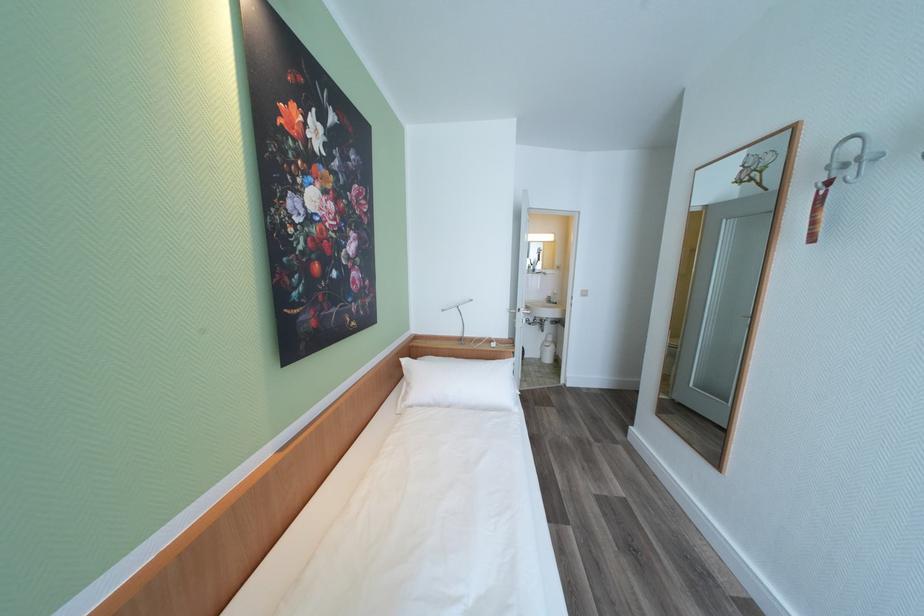
This screenshot has width=924, height=616. Describe the element at coordinates (546, 349) in the screenshot. I see `the toilet flush button` at that location.